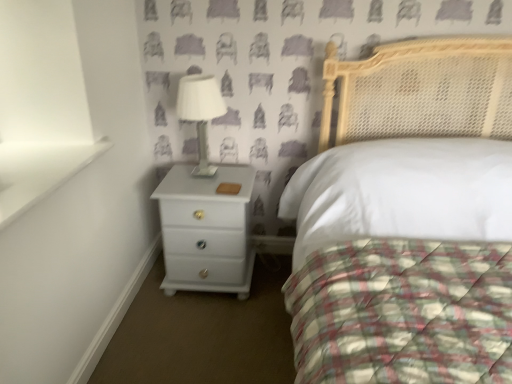
Question: Considering the positions of point (507, 322) and point (244, 187), is point (507, 322) closer or farther from the camera than point (244, 187)?

Choices:
 (A) farther
 (B) closer

Answer: (B)

Question: Is white glossy bed at center bigger or smaller than white glossy chest of drawers at lower left?

Choices:
 (A) small
 (B) big

Answer: (B)

Question: Estimate the real-world distances between objects in this image. Which object is farther from the white glossy table lamp at upper center?

Choices:
 (A) white glossy chest of drawers at lower left
 (B) white glossy bed at center

Answer: (B)

Question: Which of these objects is positioned farthest from the white glossy chest of drawers at lower left?

Choices:
 (A) white glossy table lamp at upper center
 (B) white glossy bed at center

Answer: (B)